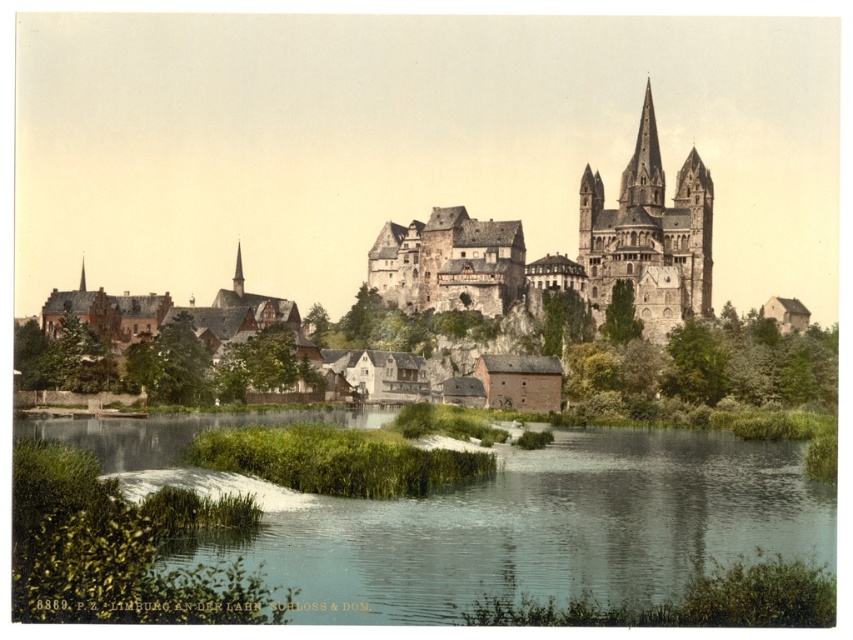
Question: Which point is farther to the camera?

Choices:
 (A) (648, 106)
 (B) (619, 202)

Answer: (A)

Question: Which of the following is the farthest from the observer?

Choices:
 (A) (80, 276)
 (B) (701, 262)
 (C) (480, 292)
 (D) (235, 264)

Answer: (A)

Question: Estimate the real-world distances between objects in this image. Which object is farther from the smooth gray steeple at upper left?

Choices:
 (A) green grassy river at lower center
 (B) smooth stone spire at upper center
 (C) brown stone castle at center

Answer: (A)

Question: Considering the relative positions of brown stone castle at center and smooth gray spire at upper center in the image provided, where is brown stone castle at center located with respect to smooth gray spire at upper center?

Choices:
 (A) right
 (B) left

Answer: (A)

Question: Is green grassy river at lower center positioned in front of brown stone castle at center?

Choices:
 (A) no
 (B) yes

Answer: (B)

Question: Does smooth stone spire at upper center appear on the right side of smooth gray steeple at upper left?

Choices:
 (A) yes
 (B) no

Answer: (A)